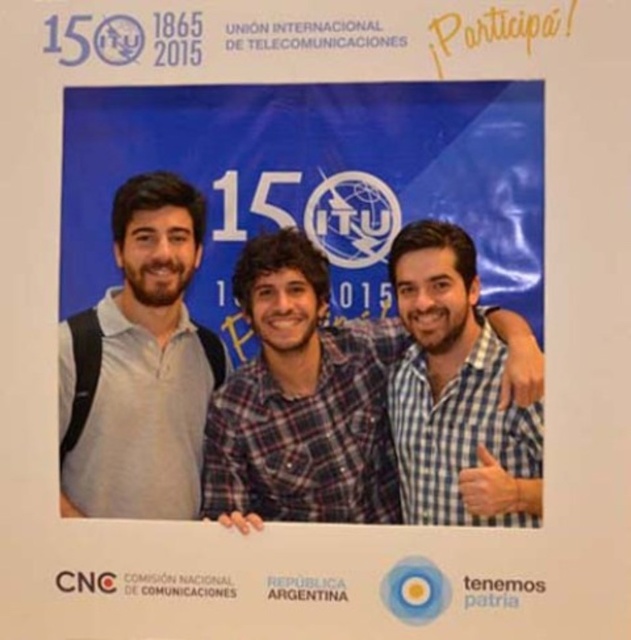
Does point (334, 355) come closer to viewer compared to point (184, 385)?

Yes, it is.

Which is below, plaid shirt at center or gray matte shirt at left?

Positioned lower is plaid shirt at center.

Locate an element on the screen. This screenshot has height=640, width=631. plaid shirt at center is located at coordinates (300, 401).

Identify the location of plaid shirt at center. (300, 401).

Who is higher up, gray matte shirt at left or checkered fabric shirt at center?

gray matte shirt at left

Does gray matte shirt at left appear over checkered fabric shirt at center?

Indeed, gray matte shirt at left is positioned over checkered fabric shirt at center.

Is point (124, 413) positioned behind point (433, 516)?

Yes, point (124, 413) is behind point (433, 516).

Identify the location of gray matte shirt at left. This screenshot has height=640, width=631. (146, 364).

Can you confirm if plaid shirt at center is shorter than checkered fabric shirt at center?

No.

Consider the image. Who is higher up, plaid shirt at center or checkered fabric shirt at center?

checkered fabric shirt at center

Describe the element at coordinates (300, 401) in the screenshot. This screenshot has height=640, width=631. I see `plaid shirt at center` at that location.

Identify the location of plaid shirt at center. (300, 401).